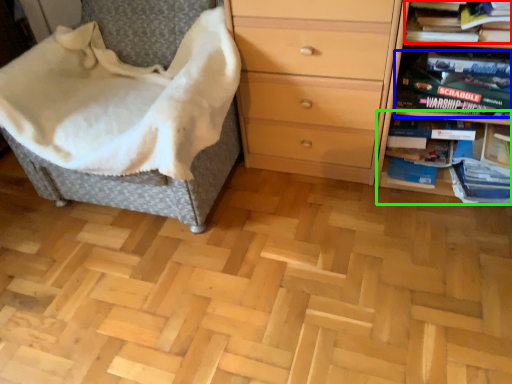
Question: Estimate the real-world distances between objects in this image. Which object is closer to book (highlighted by a red box), paperback book (highlighted by a blue box) or shelf (highlighted by a green box)?

Choices:
 (A) paperback book
 (B) shelf

Answer: (A)